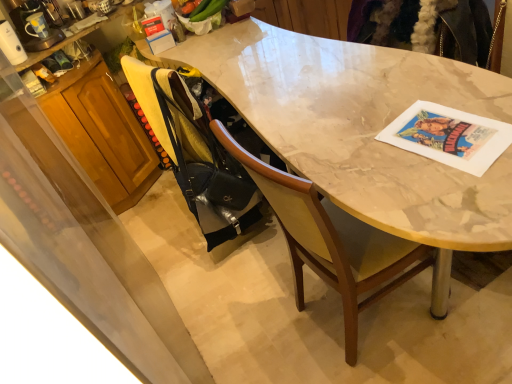
The image size is (512, 384). What do you see at coordinates (364, 131) in the screenshot?
I see `marble table at center` at bounding box center [364, 131].

Identify the location of marble table at center. This screenshot has width=512, height=384. (364, 131).

The image size is (512, 384). I want to click on white glossy coffee maker at upper left, so (11, 44).

What is the approximate height of wooden cabinet at left?

wooden cabinet at left is 34.24 inches tall.

Where is `marble table at center`? The height and width of the screenshot is (384, 512). marble table at center is located at coordinates (364, 131).

Is marble table at center at the right side of black matte handbag at lower left?

Yes.

Is marble table at center further to the viewer compared to black matte handbag at lower left?

No, it is not.

Who is shorter, marble table at center or black matte handbag at lower left?

Standing shorter between the two is marble table at center.

Based on their sizes in the image, would you say marble table at center is bigger or smaller than black matte handbag at lower left?

In the image, marble table at center appears to be larger than black matte handbag at lower left.

Considering the positions of objects black matte handbag at lower left and wooden cabinet at left in the image provided, who is more to the right, black matte handbag at lower left or wooden cabinet at left?

Positioned to the right is black matte handbag at lower left.

Is black matte handbag at lower left far away from wooden cabinet at left?

That's not correct — black matte handbag at lower left is a little close to wooden cabinet at left.

Locate an element on the screen. handbag above the wooden cabinet at left (from a real-world perspective) is located at coordinates (195, 154).

Can you tell me how much black matte handbag at lower left and wooden cabinet at left differ in facing direction?

6.67 degrees.

The image size is (512, 384). I want to click on cabinetry that is behind the marble table at center, so click(102, 132).

Can you tell me how much marble table at center and wooden cabinet at left differ in facing direction?

There is a 92.1-degree angle between the facing directions of marble table at center and wooden cabinet at left.

Is marble table at center further to camera compared to wooden cabinet at left?

No, marble table at center is closer to the viewer.

In the scene shown: From the image's perspective, would you say marble table at center is positioned over wooden cabinet at left?

No, from the image's perspective, marble table at center is not above wooden cabinet at left.

From a real-world perspective, is wooden cabinet at left above or below black matte handbag at lower left?

Clearly, from a real-world perspective, wooden cabinet at left is below black matte handbag at lower left.

Is black matte handbag at lower left at the back of wooden cabinet at left?

No, wooden cabinet at left's orientation is not away from black matte handbag at lower left.

From the image's perspective, is wooden cabinet at left positioned above or below black matte handbag at lower left?

From the image's perspective, wooden cabinet at left appears above black matte handbag at lower left.

Is white glossy coffee maker at upper left next to marble table at center and touching it?

white glossy coffee maker at upper left and marble table at center are not in contact.

Considering the sizes of white glossy coffee maker at upper left and marble table at center in the image, is white glossy coffee maker at upper left taller or shorter than marble table at center?

In the image, white glossy coffee maker at upper left appears to be shorter than marble table at center.

Is white glossy coffee maker at upper left oriented towards marble table at center?

No, white glossy coffee maker at upper left is not facing towards marble table at center.

This screenshot has width=512, height=384. Identify the location of appliance that is on the left side of marble table at center. (11, 44).

Consider the image. Is black matte handbag at lower left positioned far away from white glossy coffee maker at upper left?

No.

Between black matte handbag at lower left and white glossy coffee maker at upper left, which one has smaller size?

With smaller size is white glossy coffee maker at upper left.

Can you confirm if black matte handbag at lower left is positioned to the right of white glossy coffee maker at upper left?

Yes.

Considering the relative sizes of black matte handbag at lower left and white glossy coffee maker at upper left in the image provided, is black matte handbag at lower left shorter than white glossy coffee maker at upper left?

No.

From a real-world perspective, is marble table at center under white glossy coffee maker at upper left?

Yes, from a real-world perspective, marble table at center is beneath white glossy coffee maker at upper left.

Is marble table at center not near white glossy coffee maker at upper left?

That's right, there is a large distance between marble table at center and white glossy coffee maker at upper left.

Is white glossy coffee maker at upper left surrounded by marble table at center?

No, white glossy coffee maker at upper left is not a part of marble table at center.

Is point (332, 167) more distant than point (12, 33)?

No, (332, 167) is closer to viewer.

The height and width of the screenshot is (384, 512). I want to click on handbag to the left of marble table at center, so click(x=195, y=154).

Identify the location of cabinetry below the black matte handbag at lower left (from a real-world perspective). This screenshot has height=384, width=512. (102, 132).

Consider the image. Based on their spatial positions, is marble table at center or white glossy coffee maker at upper left closer to black matte handbag at lower left?

marble table at center lies closer to black matte handbag at lower left than the other object.

From the image, which object appears to be nearer to wooden cabinet at left, white glossy coffee maker at upper left or black matte handbag at lower left?

white glossy coffee maker at upper left.

In the scene shown: Which object lies further to the anchor point white glossy coffee maker at upper left, marble table at center or wooden cabinet at left?

marble table at center is positioned further to the anchor white glossy coffee maker at upper left.

Considering their positions, is wooden cabinet at left positioned closer to white glossy coffee maker at upper left than marble table at center?

wooden cabinet at left is closer to white glossy coffee maker at upper left.

When comparing their distances from marble table at center, does wooden cabinet at left or black matte handbag at lower left seem further?

wooden cabinet at left is positioned further to the anchor marble table at center.

Based on the photo, based on their spatial positions, is white glossy coffee maker at upper left or wooden cabinet at left further from marble table at center?

white glossy coffee maker at upper left lies further to marble table at center than the other object.

From the image, which object appears to be nearer to wooden cabinet at left, marble table at center or black matte handbag at lower left?

The object closer to wooden cabinet at left is black matte handbag at lower left.

From the image, which object appears to be nearer to white glossy coffee maker at upper left, black matte handbag at lower left or marble table at center?

black matte handbag at lower left is closer to white glossy coffee maker at upper left.

At what (x,y) coordinates should I click in order to perform the action: click on handbag located between marble table at center and wooden cabinet at left in the depth direction. Please return your answer as a coordinate pair (x, y). Looking at the image, I should click on (195, 154).

Where is `handbag between white glossy coffee maker at upper left and marble table at center`? handbag between white glossy coffee maker at upper left and marble table at center is located at coordinates (195, 154).

The width and height of the screenshot is (512, 384). Find the location of `cabinetry between white glossy coffee maker at upper left and marble table at center in the horizontal direction`. cabinetry between white glossy coffee maker at upper left and marble table at center in the horizontal direction is located at coordinates (102, 132).

This screenshot has height=384, width=512. Identify the location of cabinetry located between white glossy coffee maker at upper left and black matte handbag at lower left in the left-right direction. (102, 132).